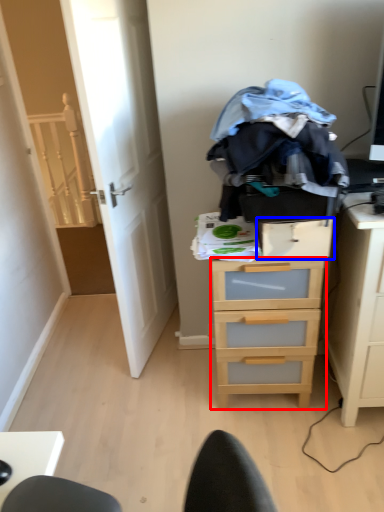
Question: Which point is closer to the camera, chest of drawers (highlighted by a red box) or drawer (highlighted by a blue box)?

Choices:
 (A) chest of drawers
 (B) drawer

Answer: (B)